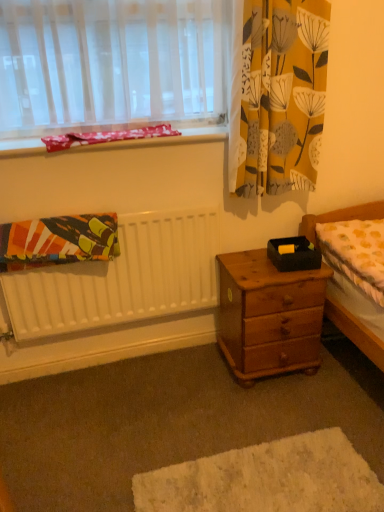
Locate an element on the screen. The width and height of the screenshot is (384, 512). yellow dotted fabric at right is located at coordinates (356, 253).

This screenshot has width=384, height=512. Describe the element at coordinates (164, 139) in the screenshot. I see `pink fabric at upper left` at that location.

Measure the distance between white sheer curtain at upper left and camera.

white sheer curtain at upper left is 5.14 feet from camera.

The width and height of the screenshot is (384, 512). I want to click on wooden drawer at lower right, so click(x=170, y=421).

Locate an element on the screen. yellow dotted fabric at right is located at coordinates (356, 253).

Considering the points (250, 156) and (45, 224), which point is in front, point (250, 156) or point (45, 224)?

The point (45, 224) is in front.

From a real-world perspective, is yellow floral fabric at upper right on textured cotton blanket at left?

Correct, in the physical world, yellow floral fabric at upper right is higher than textured cotton blanket at left.

Considering the sizes of objects yellow floral fabric at upper right and textured cotton blanket at left in the image provided, who is shorter, yellow floral fabric at upper right or textured cotton blanket at left?

textured cotton blanket at left is shorter.

Considering the relative sizes of yellow floral fabric at upper right and textured cotton blanket at left in the image provided, is yellow floral fabric at upper right bigger than textured cotton blanket at left?

Correct, yellow floral fabric at upper right is larger in size than textured cotton blanket at left.

Where is `window sill that appears behind the yellow dotted fabric at right`? This screenshot has height=512, width=384. window sill that appears behind the yellow dotted fabric at right is located at coordinates (164, 139).

Which of these two, yellow dotted fabric at right or pink fabric at upper left, is thinner?

pink fabric at upper left.

Could pink fabric at upper left be considered to be inside yellow dotted fabric at right?

No, pink fabric at upper left is located outside of yellow dotted fabric at right.

Who is bigger, white sheer curtain at upper left or textured cotton blanket at left?

white sheer curtain at upper left.

Considering the sizes of objects white sheer curtain at upper left and textured cotton blanket at left in the image provided, who is thinner, white sheer curtain at upper left or textured cotton blanket at left?

textured cotton blanket at left is thinner.

From a real-world perspective, is white sheer curtain at upper left physically below textured cotton blanket at left?

Actually, white sheer curtain at upper left is physically above textured cotton blanket at left in the real world.

Is wooden drawer at lower right facing away from yellow dotted fabric at right?

No, wooden drawer at lower right is not facing the opposite direction of yellow dotted fabric at right.

From a real-world perspective, between wooden drawer at lower right and yellow dotted fabric at right, who is vertically lower?

wooden drawer at lower right.

Between wooden drawer at lower right and yellow dotted fabric at right, which one has larger size?

wooden drawer at lower right.

Is wooden drawer at lower right spatially inside yellow dotted fabric at right, or outside of it?

wooden drawer at lower right lies outside yellow dotted fabric at right.

Is wooden nightstand at center touching yellow dotted fabric at right?

No, wooden nightstand at center is not in contact with yellow dotted fabric at right.

Is wooden nightstand at center smaller than yellow dotted fabric at right?

No.

From the image's perspective, which one is positioned lower, wooden nightstand at center or yellow dotted fabric at right?

wooden nightstand at center is shown below in the image.

Find the location of a particular element. nightstand behind the yellow dotted fabric at right is located at coordinates (269, 316).

From the picture: Is wooden nightstand at center completely or partially outside of wooden drawer at lower right?

Absolutely, wooden nightstand at center is external to wooden drawer at lower right.

Locate an element on the screen. plain lying below the wooden nightstand at center (from the image's perspective) is located at coordinates (170, 421).

Is wooden nightstand at center bigger than wooden drawer at lower right?

No.

Considering the positions of objects wooden nightstand at center and wooden drawer at lower right in the image provided, who is more to the right, wooden nightstand at center or wooden drawer at lower right?

From the viewer's perspective, wooden nightstand at center appears more on the right side.

Is textured cotton blanket at left behind yellow dotted fabric at right?

Yes, the depth of textured cotton blanket at left is greater than that of yellow dotted fabric at right.

In terms of height, does textured cotton blanket at left look taller or shorter compared to yellow dotted fabric at right?

Considering their sizes, textured cotton blanket at left has less height than yellow dotted fabric at right.

This screenshot has width=384, height=512. In the image, there is a yellow dotted fabric at right. What are the coordinates of `blanket above it (from the image's perspective)` in the screenshot? It's located at (58, 241).

Are textured cotton blanket at left and yellow dotted fabric at right making contact?

textured cotton blanket at left and yellow dotted fabric at right are not in contact.

The width and height of the screenshot is (384, 512). Find the location of `blanket behind the yellow floral fabric at upper right`. blanket behind the yellow floral fabric at upper right is located at coordinates (58, 241).

I want to click on mattress on the right of pink fabric at upper left, so click(356, 253).

Based on their spatial positions, is wooden nightstand at center or pink fabric at upper left closer to wooden drawer at lower right?

The object closer to wooden drawer at lower right is wooden nightstand at center.

When comparing their distances from textured cotton blanket at left, does white matte radiator at left or yellow dotted fabric at right seem closer?

white matte radiator at left is closer to textured cotton blanket at left.

From the image, which object appears to be farther from white sheer curtain at upper left, wooden drawer at lower right or yellow floral fabric at upper right?

wooden drawer at lower right is further to white sheer curtain at upper left.

Considering their positions, is pink fabric at upper left positioned further to yellow floral fabric at upper right than white sheer curtain at upper left?

white sheer curtain at upper left.

Considering their positions, is wooden drawer at lower right positioned further to white sheer curtain at upper left than white matte radiator at left?

Among the two, wooden drawer at lower right is located further to white sheer curtain at upper left.

Which object lies further to the anchor point yellow floral fabric at upper right, white sheer curtain at upper left or wooden drawer at lower right?

wooden drawer at lower right lies further to yellow floral fabric at upper right than the other object.

From the picture: Estimate the real-world distances between objects in this image. Which object is further from wooden drawer at lower right, white matte radiator at left or pink fabric at upper left?

Based on the image, pink fabric at upper left appears to be further to wooden drawer at lower right.

Based on their spatial positions, is wooden nightstand at center or pink fabric at upper left closer to yellow dotted fabric at right?

wooden nightstand at center is closer to yellow dotted fabric at right.

You are a GUI agent. You are given a task and a screenshot of the screen. Output one action in this format:
    pyautogui.click(x=<x>, y=<y>)
    Task: Click on the window sill between yellow floral fabric at upper right and wooden nightstand at center from top to bottom
    This screenshot has height=512, width=384.
    Given the screenshot: What is the action you would take?
    click(164, 139)

Find the location of a particular element. window sill situated between white matte radiator at left and yellow dotted fabric at right from left to right is located at coordinates (164, 139).

This screenshot has height=512, width=384. What are the coordinates of `blanket between white sheer curtain at upper left and white matte radiator at left from top to bottom` in the screenshot? It's located at (58, 241).

You are a GUI agent. You are given a task and a screenshot of the screen. Output one action in this format:
    pyautogui.click(x=<x>, y=<y>)
    Task: Click on the radiator between textured cotton blanket at left and yellow floral fabric at upper right from left to right
    The width and height of the screenshot is (384, 512).
    Given the screenshot: What is the action you would take?
    pyautogui.click(x=122, y=278)